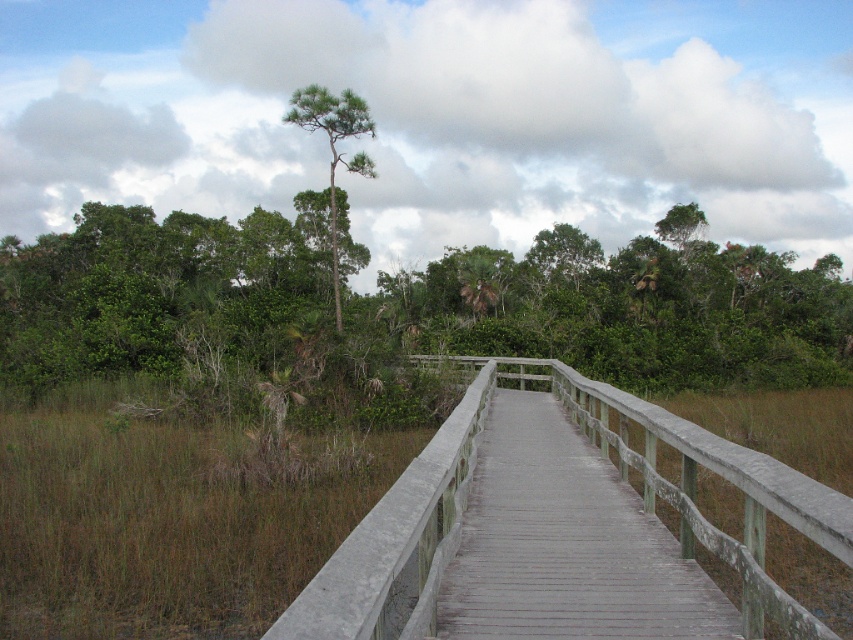
Question: Estimate the real-world distances between objects in this image. Which object is farther from the gray wooden bridge at center?

Choices:
 (A) green textured tree at upper center
 (B) gray wooden boardwalk at center

Answer: (A)

Question: Can you confirm if gray wooden bridge at center is bigger than gray wooden boardwalk at center?

Choices:
 (A) no
 (B) yes

Answer: (B)

Question: Which point is farther to the camera?

Choices:
 (A) gray wooden bridge at center
 (B) gray wooden boardwalk at center

Answer: (B)

Question: Is gray wooden boardwalk at center to the left of green textured tree at upper center from the viewer's perspective?

Choices:
 (A) no
 (B) yes

Answer: (A)

Question: Which point is closer to the camera taking this photo?

Choices:
 (A) tap(294, 116)
 (B) tap(763, 579)
 (C) tap(497, 435)

Answer: (B)

Question: Is gray wooden bridge at center to the left of green textured tree at upper center from the viewer's perspective?

Choices:
 (A) no
 (B) yes

Answer: (A)